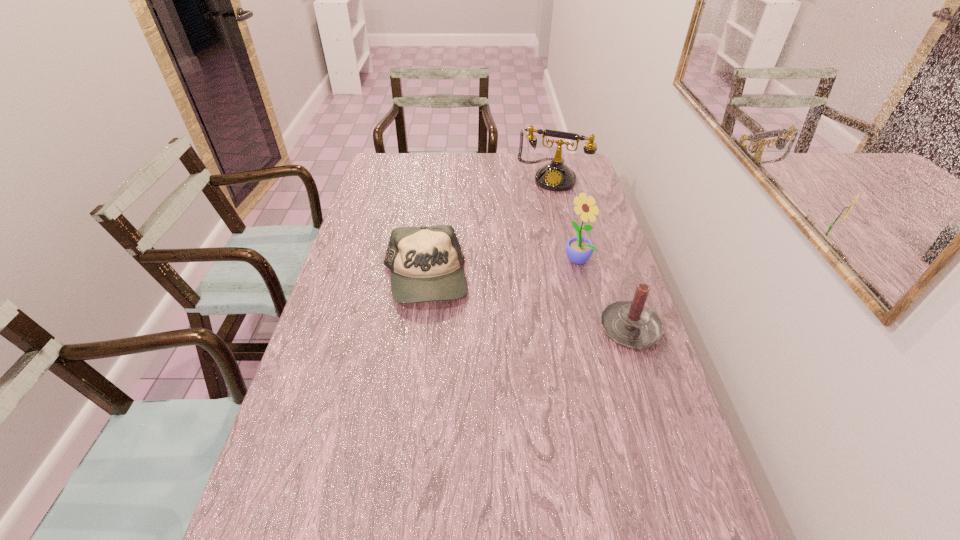
What are the coordinates of `free space between the baseball cap and the candle` in the screenshot? It's located at (528, 306).

You are a GUI agent. You are given a task and a screenshot of the screen. Output one action in this format:
    pyautogui.click(x=<x>, y=<y>)
    Task: Click on the free space that is in between the sunflower and the second tallest object
    The width and height of the screenshot is (960, 540).
    Given the screenshot: What is the action you would take?
    pyautogui.click(x=564, y=218)

Locate an element on the screen. vacant space that's between the third shortest object and the sunflower is located at coordinates (564, 218).

Identify which object is located as the third nearest to the candle. Please provide its 2D coordinates. Your answer should be formatted as a tuple, i.e. [(x, y)], where the tuple contains the x and y coordinates of a point satisfying the conditions above.

[(555, 176)]

Select which object is the third closest to the baseball cap. Please provide its 2D coordinates. Your answer should be formatted as a tuple, i.e. [(x, y)], where the tuple contains the x and y coordinates of a point satisfying the conditions above.

[(555, 176)]